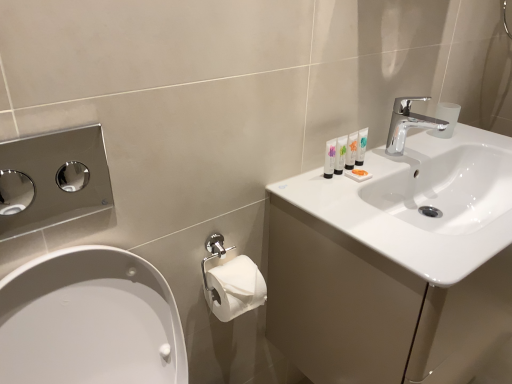
The height and width of the screenshot is (384, 512). In order to click on free point to the right of translucent plastic tubes at upper right, arranged as the 1th mouthwash when viewed from the right in this screenshot , I will do `click(398, 161)`.